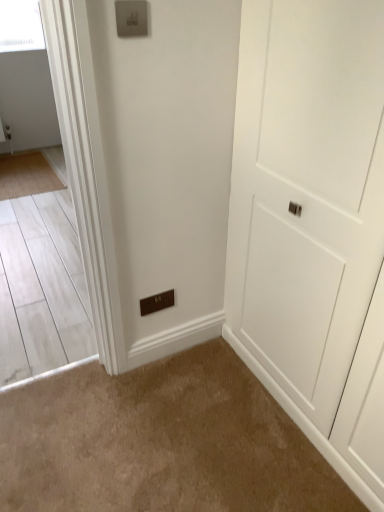
What do you see at coordinates (26, 175) in the screenshot? I see `bamboo mat at left` at bounding box center [26, 175].

Identify the location of bamboo mat at left. This screenshot has width=384, height=512. (26, 175).

What do you see at coordinates (157, 302) in the screenshot? I see `brown plastic light switch at lower center, which is the first light switch in bottom-to-top order` at bounding box center [157, 302].

Find the location of a particular element. satin silver switch at upper center, which is the second light switch in bottom-to-top order is located at coordinates (131, 18).

Describe the element at coordinates (131, 18) in the screenshot. I see `satin silver switch at upper center, arranged as the first light switch when viewed from the top` at that location.

Where is `white matte door at center`? This screenshot has width=384, height=512. white matte door at center is located at coordinates (306, 191).

From a real-world perspective, is bamboo mat at left on top of white matte door at center?

Incorrect, from a real-world perspective, bamboo mat at left is lower than white matte door at center.

Which of these two, bamboo mat at left or white matte door at center, is bigger?

white matte door at center is bigger.

From the image's perspective, is bamboo mat at left located above or below white matte door at center?

bamboo mat at left is above white matte door at center.

You are a GUI agent. You are given a task and a screenshot of the screen. Output one action in this format:
    pyautogui.click(x=<x>, y=<y>)
    Task: Click on the mat located underneath the white matte door at center (from a real-world perspective)
    
    Given the screenshot: What is the action you would take?
    pyautogui.click(x=26, y=175)

Could you tell me if brown plastic light switch at lower center, the 1th light switch positioned from the back, is turned towards white matte door at center?

No, brown plastic light switch at lower center, the 1th light switch positioned from the back, does not turn towards white matte door at center.

Can white matte door at center be found inside brown plastic light switch at lower center, which is the first light switch in bottom-to-top order?

No, white matte door at center is not surrounded by brown plastic light switch at lower center, which is the first light switch in bottom-to-top order.

From a real-world perspective, who is located higher, brown plastic light switch at lower center, the 1th light switch positioned from the back, or white matte door at center?

white matte door at center, from a real-world perspective.

Locate an element on the screen. The image size is (384, 512). the 1st light switch counting from the left of the white matte door at center is located at coordinates (157, 302).

In the image, is brown plastic light switch at lower center, which is the first light switch in bottom-to-top order, positioned in front of or behind bamboo mat at left?

Visually, brown plastic light switch at lower center, which is the first light switch in bottom-to-top order, is located in front of bamboo mat at left.

Considering the sizes of objects brown plastic light switch at lower center, the 2th light switch positioned from the front, and bamboo mat at left in the image provided, who is smaller, brown plastic light switch at lower center, the 2th light switch positioned from the front, or bamboo mat at left?

brown plastic light switch at lower center, the 2th light switch positioned from the front.

From the image's perspective, which one is positioned lower, brown plastic light switch at lower center, which is the first light switch in bottom-to-top order, or bamboo mat at left?

brown plastic light switch at lower center, which is the first light switch in bottom-to-top order, from the image's perspective.

Is brown plastic light switch at lower center, the 1th light switch positioned from the back, oriented away from bamboo mat at left?

Yes, brown plastic light switch at lower center, the 1th light switch positioned from the back,'s orientation is away from bamboo mat at left.

Who is shorter, white matte door at center or brown matte switchplate at lower center?

brown matte switchplate at lower center is shorter.

You are a GUI agent. You are given a task and a screenshot of the screen. Output one action in this format:
    pyautogui.click(x=<x>, y=<y>)
    Task: Click on the plain behind the white matte door at center
    
    Given the screenshot: What is the action you would take?
    pyautogui.click(x=160, y=442)

From the picture: From a real-world perspective, is white matte door at center physically below brown matte switchplate at lower center?

Incorrect, from a real-world perspective, white matte door at center is higher than brown matte switchplate at lower center.

Does white matte door at center have a smaller size compared to brown matte switchplate at lower center?

No.

Is brown matte switchplate at lower center completely or partially outside of brown plastic light switch at lower center, positioned as the second light switch in top-to-bottom order?

brown matte switchplate at lower center lies outside brown plastic light switch at lower center, positioned as the second light switch in top-to-bottom order,'s area.

Is brown matte switchplate at lower center facing away from brown plastic light switch at lower center, the 1th light switch positioned from the back?

brown matte switchplate at lower center does not have its back to brown plastic light switch at lower center, the 1th light switch positioned from the back.

Is point (220, 369) behind point (159, 309)?

That is True.

Is brown matte switchplate at lower center touching brown plastic light switch at lower center, the 1th light switch positioned from the back?

brown matte switchplate at lower center and brown plastic light switch at lower center, the 1th light switch positioned from the back, are not in contact.

Can you confirm if satin silver switch at upper center, which is the second light switch in bottom-to-top order, is taller than brown plastic light switch at lower center, the 1th light switch positioned from the back?

No, satin silver switch at upper center, which is the second light switch in bottom-to-top order, is not taller than brown plastic light switch at lower center, the 1th light switch positioned from the back.

Considering the sizes of satin silver switch at upper center, arranged as the first light switch when viewed from the top, and brown plastic light switch at lower center, the 1th light switch positioned from the back, in the image, is satin silver switch at upper center, arranged as the first light switch when viewed from the top, wider or thinner than brown plastic light switch at lower center, the 1th light switch positioned from the back,?

Clearly, satin silver switch at upper center, arranged as the first light switch when viewed from the top, has more width compared to brown plastic light switch at lower center, the 1th light switch positioned from the back.

Could you tell me if satin silver switch at upper center, arranged as the first light switch when viewed from the top, is facing brown plastic light switch at lower center, positioned as the second light switch in top-to-bottom order?

No, satin silver switch at upper center, arranged as the first light switch when viewed from the top, is not aimed at brown plastic light switch at lower center, positioned as the second light switch in top-to-bottom order.

Does point (139, 0) appear closer or farther from the camera than point (142, 298)?

Point (139, 0) appears to be closer to the viewer than point (142, 298).

Between bamboo mat at left and brown matte switchplate at lower center, which one has larger width?

brown matte switchplate at lower center.

Is the position of bamboo mat at left less distant than that of brown matte switchplate at lower center?

No, the depth of bamboo mat at left is greater than that of brown matte switchplate at lower center.

From a real-world perspective, does bamboo mat at left stand above brown matte switchplate at lower center?

No.

From the image's perspective, is bamboo mat at left located beneath brown matte switchplate at lower center?

No, from the image's perspective, bamboo mat at left is not below brown matte switchplate at lower center.

At what (x,y) coordinates should I click in order to perform the action: click on mat located underneath the white matte door at center (from a real-world perspective). Please return your answer as a coordinate pair (x, y). Looking at the image, I should click on (26, 175).

This screenshot has width=384, height=512. In order to click on light switch lying below the white matte door at center (from the image's perspective) in this screenshot , I will do `click(157, 302)`.

Based on their spatial positions, is white matte door at center or brown matte switchplate at lower center further from bamboo mat at left?

white matte door at center lies further to bamboo mat at left than the other object.

From the image, which object appears to be nearer to brown plastic light switch at lower center, the 2th light switch positioned from the front, white matte door at center or bamboo mat at left?

white matte door at center.

When comparing their distances from satin silver switch at upper center, arranged as the first light switch when viewed from the top, does brown plastic light switch at lower center, the 2th light switch positioned from the front, or white matte door at center seem closer?

white matte door at center lies closer to satin silver switch at upper center, arranged as the first light switch when viewed from the top, than the other object.

When comparing their distances from white matte door at center, does brown plastic light switch at lower center, positioned as the second light switch in top-to-bottom order, or satin silver switch at upper center, which appears as the first light switch when viewed from the front, seem further?

Based on the image, satin silver switch at upper center, which appears as the first light switch when viewed from the front, appears to be further to white matte door at center.

Based on the photo, from the image, which object appears to be farther from satin silver switch at upper center, which is the second light switch in bottom-to-top order, brown matte switchplate at lower center or brown plastic light switch at lower center, the 1th light switch positioned from the back?

The object further to satin silver switch at upper center, which is the second light switch in bottom-to-top order, is brown matte switchplate at lower center.

Based on their spatial positions, is white matte door at center or brown plastic light switch at lower center, positioned as the second light switch in top-to-bottom order, closer to satin silver switch at upper center, which is the second light switch in bottom-to-top order?

white matte door at center is closer to satin silver switch at upper center, which is the second light switch in bottom-to-top order.

Estimate the real-world distances between objects in this image. Which object is further from brown matte switchplate at lower center, bamboo mat at left or brown plastic light switch at lower center, which is the first light switch in bottom-to-top order?

bamboo mat at left is further to brown matte switchplate at lower center.

When comparing their distances from white matte door at center, does brown plastic light switch at lower center, which is the first light switch in bottom-to-top order, or brown matte switchplate at lower center seem closer?

brown matte switchplate at lower center is positioned closer to the anchor white matte door at center.

This screenshot has width=384, height=512. What are the coordinates of `light switch between white matte door at center and brown plastic light switch at lower center, which is the first light switch in bottom-to-top order, from front to back` in the screenshot? It's located at (131, 18).

Locate an element on the screen. This screenshot has height=512, width=384. light switch that lies between satin silver switch at upper center, which appears as the first light switch when viewed from the front, and brown matte switchplate at lower center from top to bottom is located at coordinates (157, 302).

Where is `door between satin silver switch at upper center, arranged as the first light switch when viewed from the top, and brown matte switchplate at lower center from top to bottom`? The width and height of the screenshot is (384, 512). door between satin silver switch at upper center, arranged as the first light switch when viewed from the top, and brown matte switchplate at lower center from top to bottom is located at coordinates (306, 191).

This screenshot has height=512, width=384. Find the location of `plain between white matte door at center and brown plastic light switch at lower center, the 2th light switch positioned from the front, in the front-back direction`. plain between white matte door at center and brown plastic light switch at lower center, the 2th light switch positioned from the front, in the front-back direction is located at coordinates (160, 442).